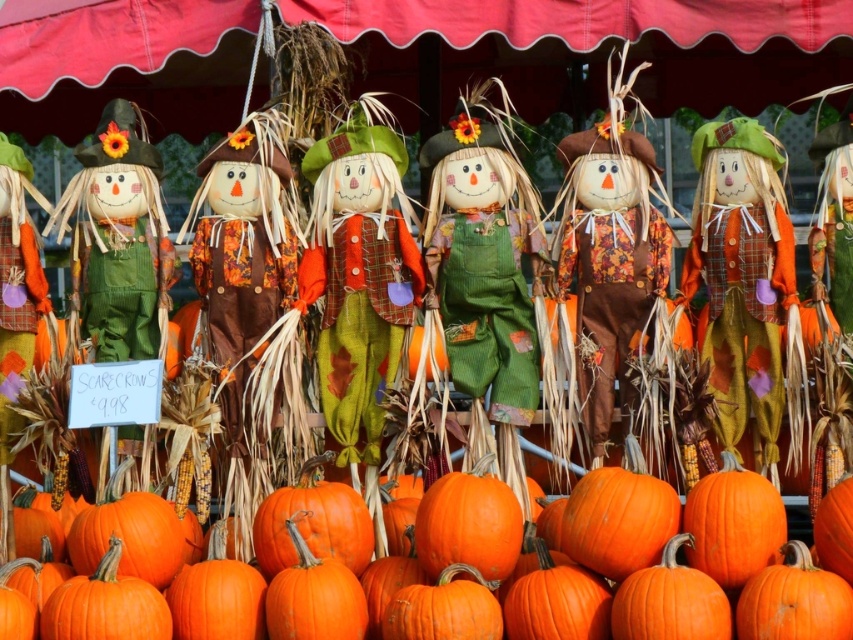
You are planning to hang a new decoration between the red fabric canopy at upper center and the matte brown scarecrow at center. Which object should you avoid placing the decoration in front of to ensure it is visible from the front view?

You should avoid placing the decoration in front of the red fabric canopy at upper center because it is larger than the matte brown scarecrow at center, making it more likely to block the decoration from view.